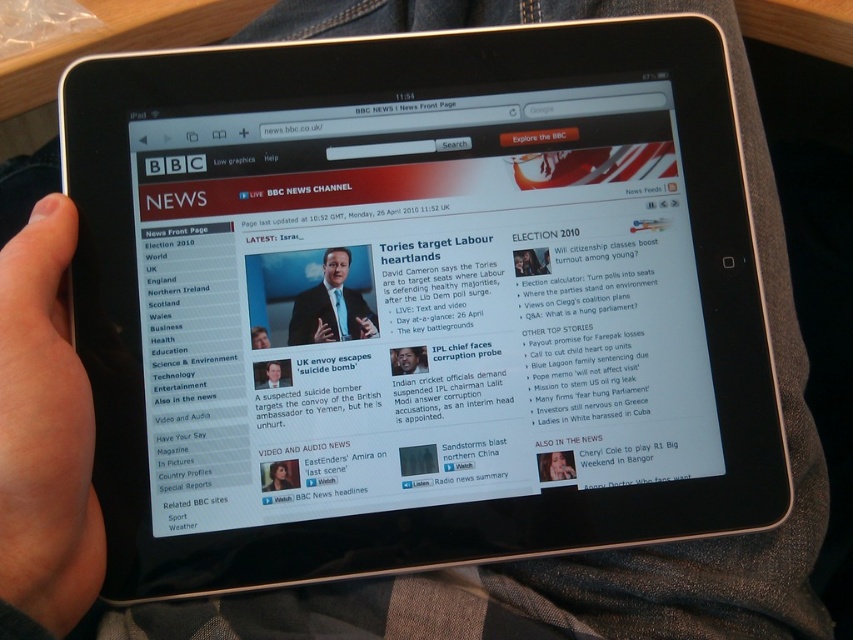
You are a fashion designer observing the image. You need to decide which item is taller between the matte black suit at center and the smooth skin face at lower center. Which one is taller?

The matte black suit at center is taller than the smooth skin face at lower center according to the description.

You are a photographer adjusting lighting for a portrait. You notice the skinsmoothhand at left and smooth skin face at lower left in the frame. Which object should you focus on to ensure proper exposure for the main subject?

The smooth skin face at lower left should be the main subject since it is smaller and closer to the center of the frame compared to the skinsmoothhand at left, which is taller and likely in the background.

You are a photographer taking a portrait and notice the skinsmoothhand at left and the smooth skin face at lower center in your frame. Which object is located more to the left?

The skinsmoothhand at left is positioned on the left side of smooth skin face at lower center, so it is more to the left.